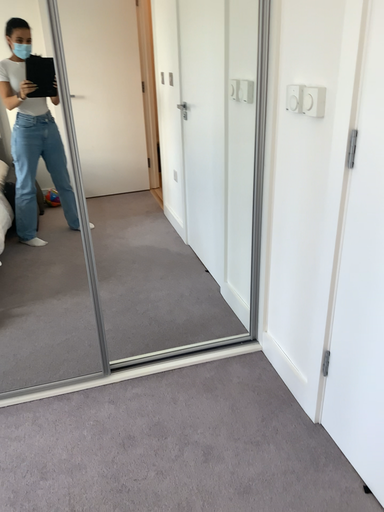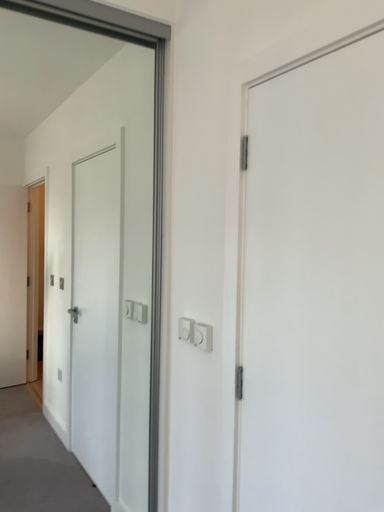
Question: How did the camera likely rotate when shooting the video?

Choices:
 (A) rotated right
 (B) rotated left

Answer: (A)